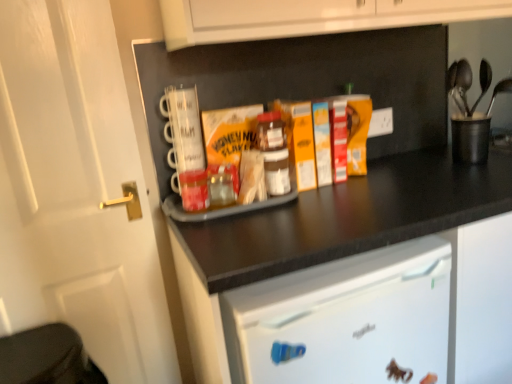
Question: Is white matte door at left taller or shorter than translucent plastic jar at center?

Choices:
 (A) tall
 (B) short

Answer: (A)

Question: Which is correct: white matte door at left is inside translucent plastic jar at center, or outside of it?

Choices:
 (A) inside
 (B) outside

Answer: (B)

Question: Which object is the closest to the translucent plastic jar at center?

Choices:
 (A) black plastic utensil holder at upper right
 (B) white matte door at left
 (C) black matte tray at center

Answer: (C)

Question: Which is farther from the black matte tray at center?

Choices:
 (A) white matte door at left
 (B) translucent plastic jar at center
 (C) black plastic utensil holder at upper right

Answer: (A)